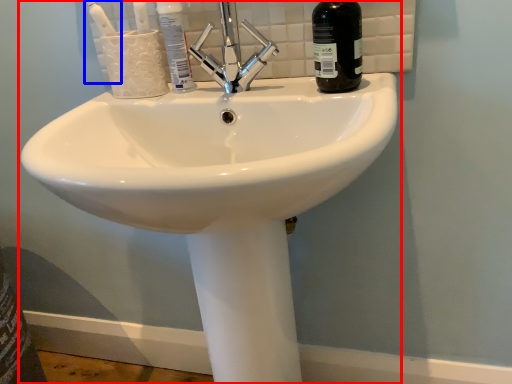
Question: Which object is further to the camera taking this photo, sink (highlighted by a red box) or toothbrush (highlighted by a blue box)?

Choices:
 (A) sink
 (B) toothbrush

Answer: (B)